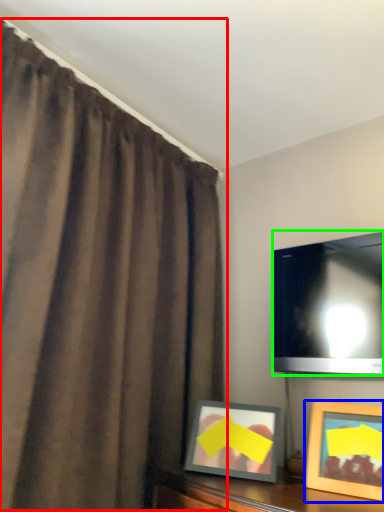
Question: Based on their relative distances, which object is farther from curtain (highlighted by a red box)? Choose from picture frame (highlighted by a blue box) and television (highlighted by a green box).

Choices:
 (A) picture frame
 (B) television

Answer: (A)